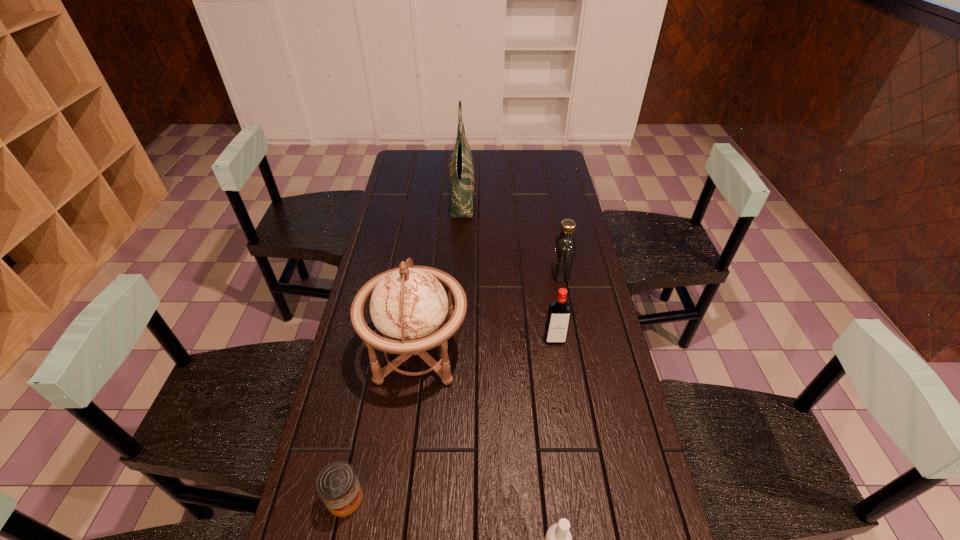
Image resolution: width=960 pixels, height=540 pixels. I want to click on tote bag, so click(x=461, y=167).

Locate an element on the screen. globe is located at coordinates (409, 306).

Find the location of a particular element. the fifth nearest object is located at coordinates (564, 249).

Where is `the second nearest vodka`? the second nearest vodka is located at coordinates (559, 312).

The image size is (960, 540). In order to click on the shortest object in this screenshot , I will do `click(337, 484)`.

You are a GUI agent. You are given a task and a screenshot of the screen. Output one action in this format:
    pyautogui.click(x=<x>, y=<y>)
    Task: Click on the fifth farthest object
    
    Given the screenshot: What is the action you would take?
    (x=337, y=484)

Locate an element on the screen. free space located on the front of the tote bag is located at coordinates (459, 248).

Locate an element on the screen. This screenshot has width=960, height=540. free space located 0.230m at the front of the globe showing Africa is located at coordinates (547, 353).

What are the coordinates of `vacant space located 0.350m on the front-facing side of the farthest vodka` in the screenshot? It's located at (450, 273).

Locate an element on the screen. The image size is (960, 540). free space located 0.080m on the front-facing side of the farthest vodka is located at coordinates (529, 273).